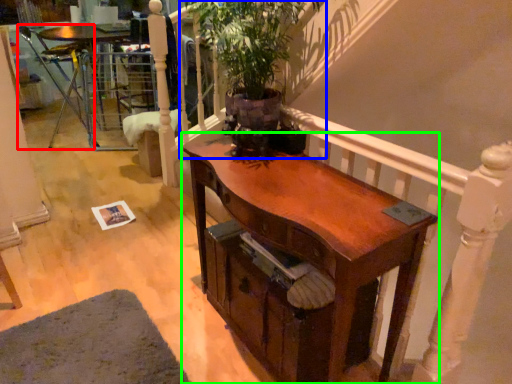
Question: Which object is the closest to the armchair (highlighted by a red box)? Choose among these: houseplant (highlighted by a blue box) or desk (highlighted by a green box).

Choices:
 (A) houseplant
 (B) desk

Answer: (A)